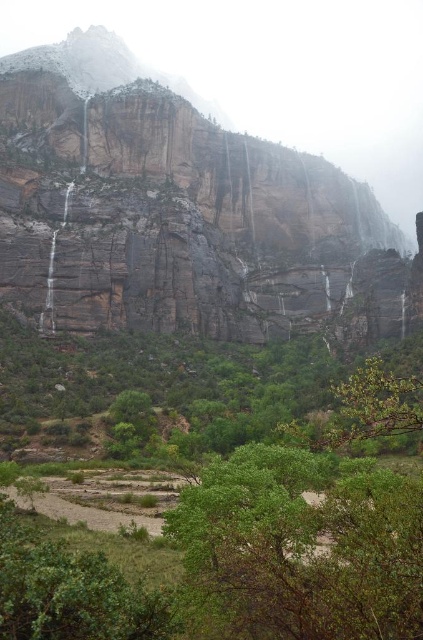
You are a hiker standing at the base of the rustic stone mountain at upper center. You want to reach the summit. If your average climbing speed is 1.5 meters per minute, how many minutes will it take to reach the summit?

The rustic stone mountain at upper center and viewer are 114.40 meters apart from each other. At a climbing speed of 1.5 meters per minute, it would take approximately 76.27 minutes to reach the summit.